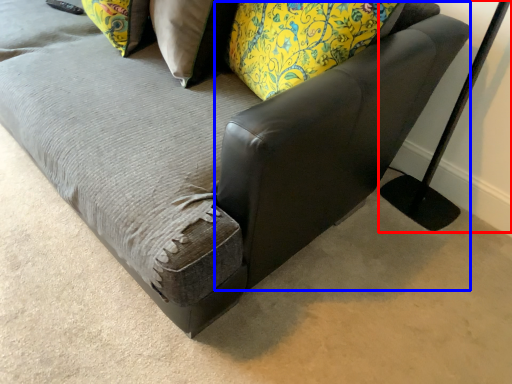
Question: Which object is further to the camera taking this photo, table lamp (highlighted by a red box) or swivel chair (highlighted by a blue box)?

Choices:
 (A) table lamp
 (B) swivel chair

Answer: (A)